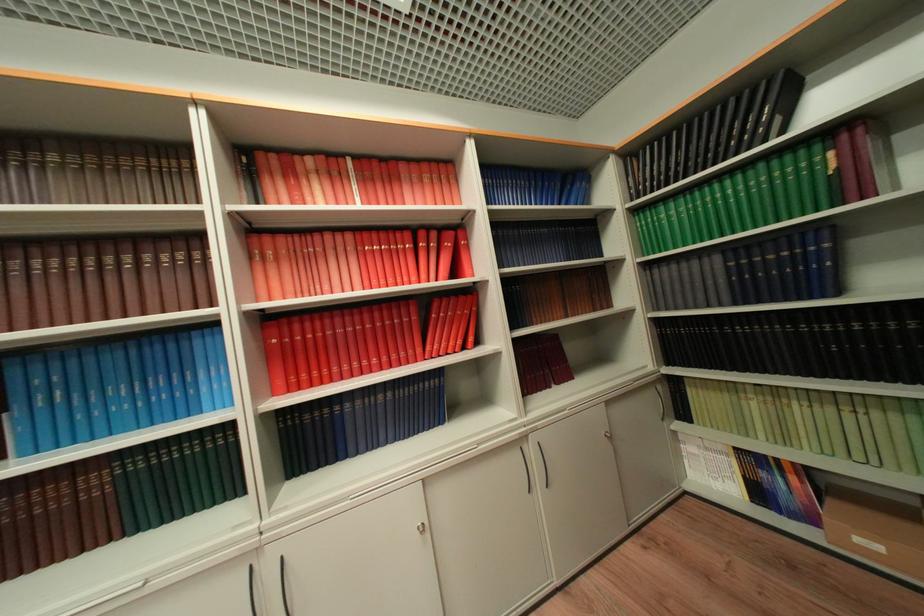
Where would you insert the right cabinet keyhole? Please return your answer as a coordinate pair (x, y).

(606, 432)